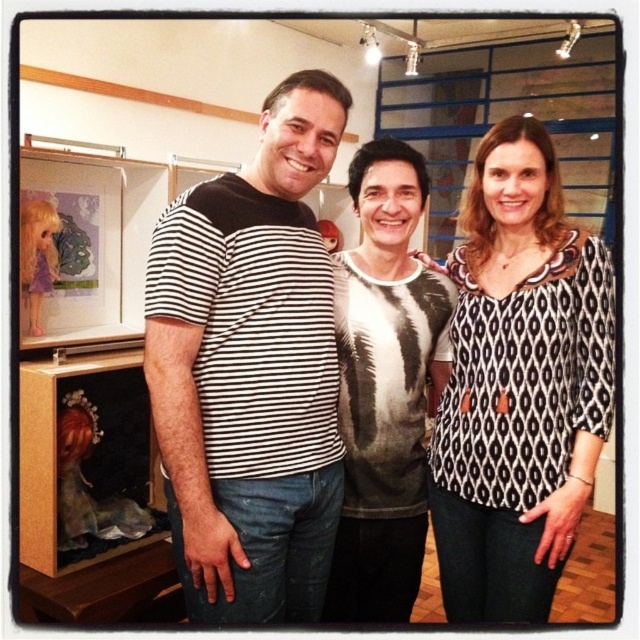
Does black printed blouse at center lie behind printed cotton shirt at center?

No, it is not.

Who is higher up, black printed blouse at center or printed cotton shirt at center?

black printed blouse at center is higher up.

In the scene shown: Who is more forward, (x=480, y=496) or (x=444, y=380)?

Positioned in front is point (x=480, y=496).

The width and height of the screenshot is (640, 640). Find the location of `black printed blouse at center`. black printed blouse at center is located at coordinates (518, 385).

Consider the image. Which is more to the right, striped cotton t-shirt at center or printed cotton shirt at center?

printed cotton shirt at center is more to the right.

Does point (296, 376) lie behind point (371, 372)?

No, (296, 376) is closer to viewer.

Between point (237, 234) and point (339, 360), which one is positioned in front?

Point (237, 234) is more forward.

The image size is (640, 640). In order to click on striped cotton t-shirt at center in this screenshot , I will do `click(250, 369)`.

Is striped cotton t-shirt at center positioned behind black printed blouse at center?

That is False.

Does point (269, 198) come in front of point (596, 336)?

Yes, it is.

The width and height of the screenshot is (640, 640). In order to click on striped cotton t-shirt at center in this screenshot , I will do `click(250, 369)`.